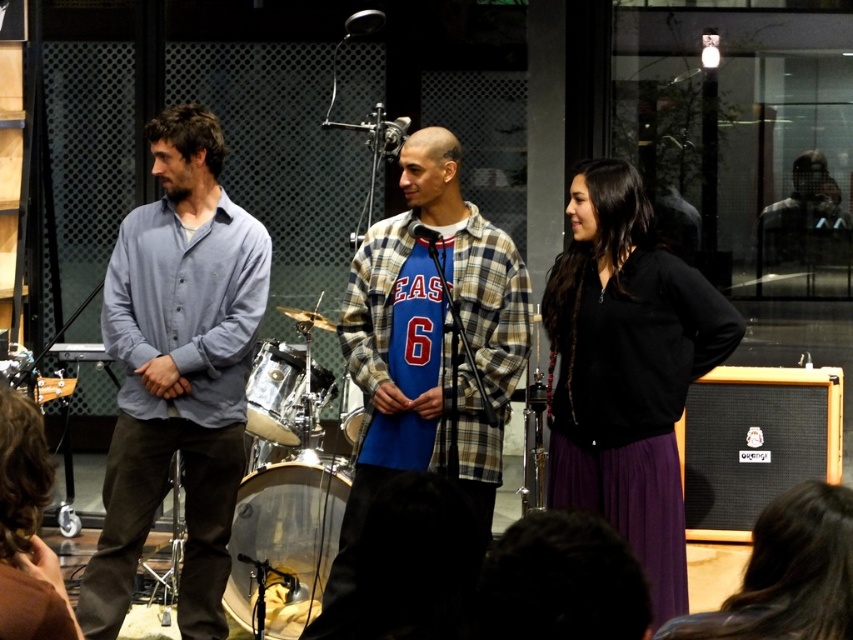
You are a photographer setting up a shoot in the music studio. You need to place a tripod between the black matte sweatshirt at center and the clear plastic drum at center. Which object should the tripod be closer to if you want it to be equidistant from both objects?

The tripod should be closer to the clear plastic drum at center because the black matte sweatshirt at center is larger in size, so placing it equidistant would require positioning it nearer to the smaller object to balance the distance.

What is the spatial relationship between the blue plaid shirt at center and the clear plastic drum at center in terms of their sizes?

The blue plaid shirt at center is larger in size than the clear plastic drum at center.

Based on the photo, you are a stagehand setting up for a performance. You need to move the clear plastic drum at center to the left side of the stage. However, there is a black matte sweatshirt at center currently blocking the path. Can you move the drum without moving the sweatshirt?

The black matte sweatshirt at center is in front of the clear plastic drum at center, so you cannot move the drum without moving the sweatshirt first.